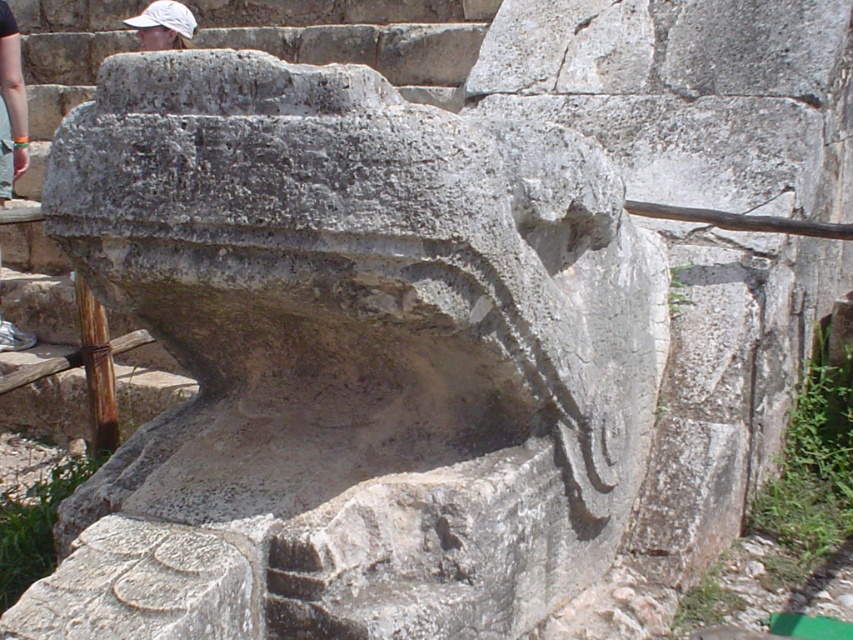
Question: Is gray stone carving at center to the right of white matte baseball cap at upper left from the viewer's perspective?

Choices:
 (A) yes
 (B) no

Answer: (A)

Question: Observing the image, what is the correct spatial positioning of gray stone carving at center in reference to white fabric at upper left?

Choices:
 (A) left
 (B) right

Answer: (B)

Question: Is gray stone carving at center closer to the viewer compared to white matte baseball cap at upper left?

Choices:
 (A) no
 (B) yes

Answer: (B)

Question: Which object is positioned closest to the white fabric at upper left?

Choices:
 (A) white matte baseball cap at upper left
 (B) gray stone carving at center

Answer: (A)

Question: Among these points, which one is nearest to the camera?

Choices:
 (A) (299, 348)
 (B) (129, 26)
 (C) (3, 49)

Answer: (A)

Question: Which point is farther to the camera?

Choices:
 (A) (494, 429)
 (B) (184, 36)
 (C) (0, 52)

Answer: (B)